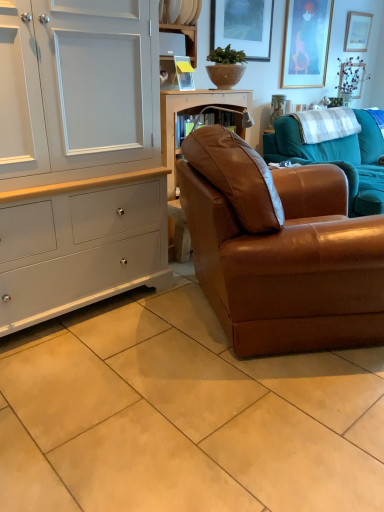
Image resolution: width=384 pixels, height=512 pixels. What are the coordinates of `unoccupied area in front of brown leather couch at right, acting as the first studio couch starting from the front` in the screenshot? It's located at (238, 435).